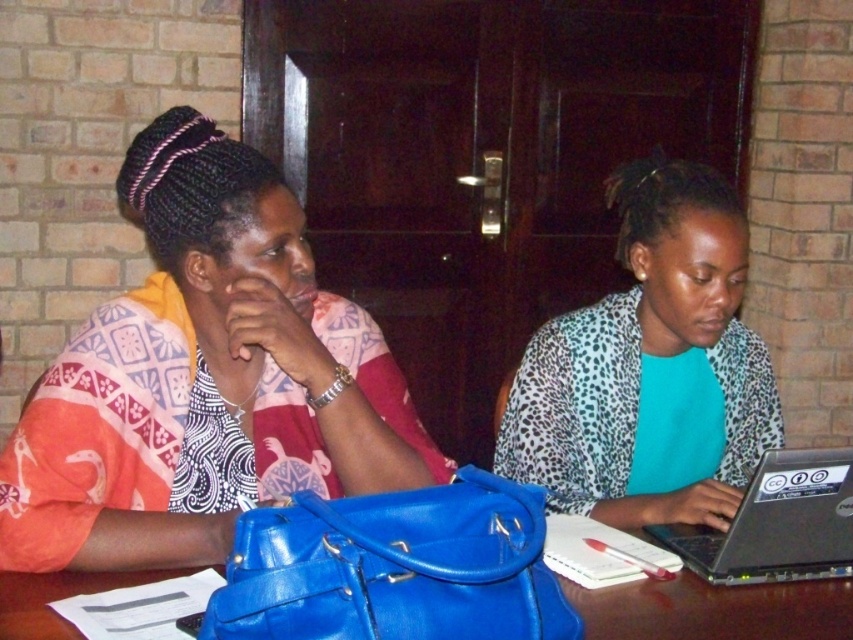
Can you confirm if blue leather bag at center is wider than silver metallic laptop at center?

Correct, the width of blue leather bag at center exceeds that of silver metallic laptop at center.

Who is shorter, blue leather bag at center or silver metallic laptop at center?

With less height is blue leather bag at center.

Is point (631, 630) positioned after point (816, 481)?

No, (631, 630) is in front of (816, 481).

Where is `blue leather bag at center`? The image size is (853, 640). blue leather bag at center is located at coordinates (714, 609).

Is matte fabric scarf at left below leopard print blazer at right?

Correct, matte fabric scarf at left is located below leopard print blazer at right.

Can you confirm if matte fabric scarf at left is wider than leopard print blazer at right?

Yes, matte fabric scarf at left is wider than leopard print blazer at right.

Where is `matte fabric scarf at left`? Image resolution: width=853 pixels, height=640 pixels. matte fabric scarf at left is located at coordinates (202, 378).

Can you confirm if matte fabric scarf at left is bigger than silver metallic laptop at center?

Indeed, matte fabric scarf at left has a larger size compared to silver metallic laptop at center.

Is matte fabric scarf at left above silver metallic laptop at center?

Correct, matte fabric scarf at left is located above silver metallic laptop at center.

Does point (244, 266) come closer to viewer compared to point (750, 552)?

That is True.

At what (x,y) coordinates should I click in order to perform the action: click on matte fabric scarf at left. Please return your answer as a coordinate pair (x, y). Looking at the image, I should click on (202, 378).